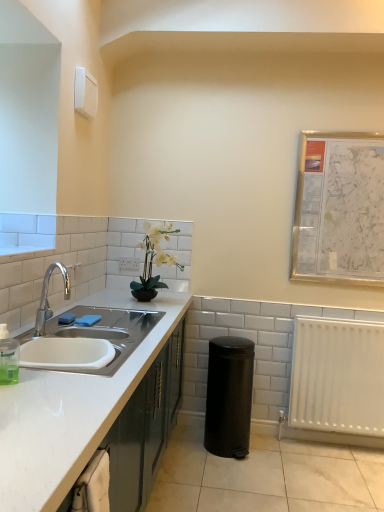
What do you see at coordinates (229, 396) in the screenshot? Image resolution: width=384 pixels, height=512 pixels. I see `black matte trash can at lower right` at bounding box center [229, 396].

At what (x,y) coordinates should I click in order to perform the action: click on silver metallic map at upper right. Please return your answer as a coordinate pair (x, y). Image resolution: width=384 pixels, height=512 pixels. Looking at the image, I should click on (x=339, y=208).

The width and height of the screenshot is (384, 512). What do you see at coordinates (66, 318) in the screenshot?
I see `blue sponge at sink left` at bounding box center [66, 318].

The height and width of the screenshot is (512, 384). Find the location of `white matte vase at center`. white matte vase at center is located at coordinates (153, 261).

Measure the distance between point (134, 269) and camera.

The depth of point (134, 269) is 2.99 meters.

Image resolution: width=384 pixels, height=512 pixels. What do you see at coordinates (86, 332) in the screenshot?
I see `white glossy sink at left` at bounding box center [86, 332].

Locate an element on the screen. translucent plastic soap dispenser at sink left is located at coordinates (8, 357).

This screenshot has width=384, height=512. Identify the location of black matte trash can at lower right. (229, 396).

Considering the positions of objects blue sponge at sink left and white matte cabinet at left in the image provided, who is more to the left, blue sponge at sink left or white matte cabinet at left?

Positioned to the left is blue sponge at sink left.

Is point (72, 318) in front of point (125, 449)?

No, (72, 318) is behind (125, 449).

From a real-world perspective, who is located higher, blue sponge at sink left or white matte cabinet at left?

From a 3D spatial view, blue sponge at sink left is above.

Would you say white matte cabinet at left is part of blue sponge at sink left's contents?

No, white matte cabinet at left is not a part of blue sponge at sink left.

Considering the sizes of objects blue sponge at sink left and white glossy sink at left in the image provided, who is thinner, blue sponge at sink left or white glossy sink at left?

blue sponge at sink left is thinner.

From a real-world perspective, is blue sponge at sink left above or below white glossy sink at left?

In terms of real-world spatial position, blue sponge at sink left is below white glossy sink at left.

Considering their positions, is blue sponge at sink left located in front of or behind white glossy sink at left?

Visually, blue sponge at sink left is located behind white glossy sink at left.

Can you confirm if translucent plastic soap dispenser at sink left is wider than white glossy sink at left?

Incorrect, the width of translucent plastic soap dispenser at sink left does not surpass that of white glossy sink at left.

There is a white glossy sink at left. Where is `bottle above it (from a real-world perspective)`? bottle above it (from a real-world perspective) is located at coordinates [x=8, y=357].

Which is behind, translucent plastic soap dispenser at sink left or white glossy sink at left?

white glossy sink at left is further from the camera.

Consider the image. Is translucent plastic soap dispenser at sink left positioned beyond the bounds of white glossy sink at left?

Yes.

From a real-world perspective, is silver metallic map at upper right on blue sponge at sink left?

Indeed, from a real-world perspective, silver metallic map at upper right stands above blue sponge at sink left.

Based on the photo, is silver metallic map at upper right facing towards blue sponge at sink left?

No, silver metallic map at upper right is not oriented towards blue sponge at sink left.

Considering the relative positions of silver metallic map at upper right and blue sponge at sink left in the image provided, is silver metallic map at upper right to the left of blue sponge at sink left from the viewer's perspective?

Incorrect, silver metallic map at upper right is not on the left side of blue sponge at sink left.

Who is bigger, blue sponge at sink left or silver metallic map at upper right?

Bigger between the two is silver metallic map at upper right.

Which is more distant, [70,314] or [334,149]?

The point [334,149] is farther from the camera.

How distant is blue sponge at sink left from silver metallic map at upper right?

5.81 feet.

Can you tell me how much white matte radiator at lower right and white plastic electric outlet at upper center differ in facing direction?

The angle between the facing direction of white matte radiator at lower right and the facing direction of white plastic electric outlet at upper center is 1.15 degrees.

Is white matte radiator at lower right in front of white plastic electric outlet at upper center?

Yes, it is in front of white plastic electric outlet at upper center.

Which is in front, point (313, 326) or point (121, 262)?

The point (313, 326) is closer.

At what (x,y) coordinates should I click in order to perform the action: click on electric outlet that appears above the white matte radiator at lower right (from the image's perspective). Please return your answer as a coordinate pair (x, y). The image size is (384, 512). Looking at the image, I should click on (129, 263).

Considering the relative positions of white matte vase at center and white matte cabinet at left in the image provided, is white matte vase at center behind white matte cabinet at left?

Yes, it is behind white matte cabinet at left.

From a real-world perspective, is white matte vase at center above or below white matte cabinet at left?

In terms of real-world spatial position, white matte vase at center is above white matte cabinet at left.

Could you tell me if white matte vase at center is facing white matte cabinet at left?

No, white matte vase at center is not turned towards white matte cabinet at left.

The image size is (384, 512). Find the location of `soap on the left of white matte cabinet at left`. soap on the left of white matte cabinet at left is located at coordinates (66, 318).

Identify the location of sink on the right of blue sponge at sink left. (86, 332).

In the scene shown: Looking at the image, which one is located further to blue sponge at sink left, translucent plastic soap dispenser at sink left or white matte radiator at lower right?

The object further to blue sponge at sink left is white matte radiator at lower right.

Based on their spatial positions, is white plastic electric outlet at upper center or white glossy sink at left further from silver metallic map at upper right?

Among the two, white glossy sink at left is located further to silver metallic map at upper right.

Estimate the real-world distances between objects in this image. Which object is closer to white matte vase at center, blue sponge at sink left or white matte radiator at lower right?

blue sponge at sink left is closer to white matte vase at center.

Which object lies nearer to the anchor point blue sponge at sink left, black matte trash can at lower right or white matte vase at center?

white matte vase at center.

Based on their spatial positions, is translucent plastic soap dispenser at sink left or white matte radiator at lower right closer to silver metallic map at upper right?

white matte radiator at lower right.

Looking at the image, which one is located further to blue sponge at sink left, white matte vase at center or silver metallic map at upper right?

Based on the image, silver metallic map at upper right appears to be further to blue sponge at sink left.

From the picture: From the image, which object appears to be farther from white plastic electric outlet at upper center, silver metallic map at upper right or black matte trash can at lower right?

Among the two, silver metallic map at upper right is located further to white plastic electric outlet at upper center.

Based on their spatial positions, is translucent plastic soap dispenser at sink left or white matte vase at center further from blue sponge at sink left?

Among the two, white matte vase at center is located further to blue sponge at sink left.

Locate an element on the screen. Image resolution: width=384 pixels, height=512 pixels. soap positioned between white matte cabinet at left and white plastic electric outlet at upper center from near to far is located at coordinates (66, 318).

Identify the location of soap positioned between translucent plastic soap dispenser at sink left and white plastic electric outlet at upper center from near to far. (66, 318).

This screenshot has width=384, height=512. Find the location of `plant between silver metallic map at upper right and black matte trash can at lower right from top to bottom`. plant between silver metallic map at upper right and black matte trash can at lower right from top to bottom is located at coordinates 153,261.

This screenshot has width=384, height=512. I want to click on appliance between white glossy sink at left and silver metallic map at upper right from front to back, so click(x=229, y=396).